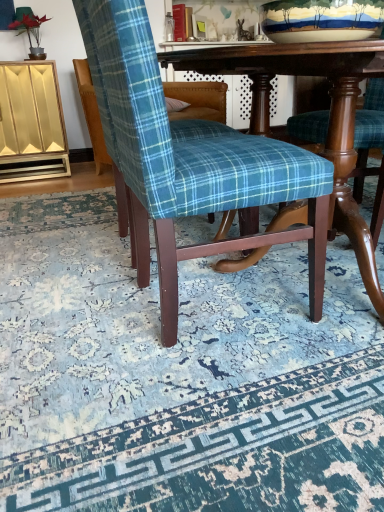
Question: Considering their positions, is matte gold cabinet at left located in front of or behind blue plaid fabric chair at center, acting as the 2th chair starting from the front?

Choices:
 (A) behind
 (B) front

Answer: (A)

Question: Based on their sizes in the image, would you say matte gold cabinet at left is bigger or smaller than blue plaid fabric chair at center, acting as the 2th chair starting from the front?

Choices:
 (A) small
 (B) big

Answer: (A)

Question: Which object is the farthest from the matte gold cabinet at left?

Choices:
 (A) blue plaid fabric chair at center
 (B) blue plaid fabric chair at center, acting as the 2th chair starting from the front
 (C) wooden table at center
 (D) earthenware bowl at upper center
 (E) blue plaid fabric chair at center, the first chair positioned from the front

Answer: (D)

Question: Based on their relative distances, which object is nearer to the earthenware bowl at upper center?

Choices:
 (A) wooden table at center
 (B) blue plaid fabric chair at center, the first chair positioned from the front
 (C) blue plaid fabric chair at center, placed as the first chair when sorted from back to front
 (D) matte gold cabinet at left
 (E) blue plaid fabric chair at center

Answer: (A)